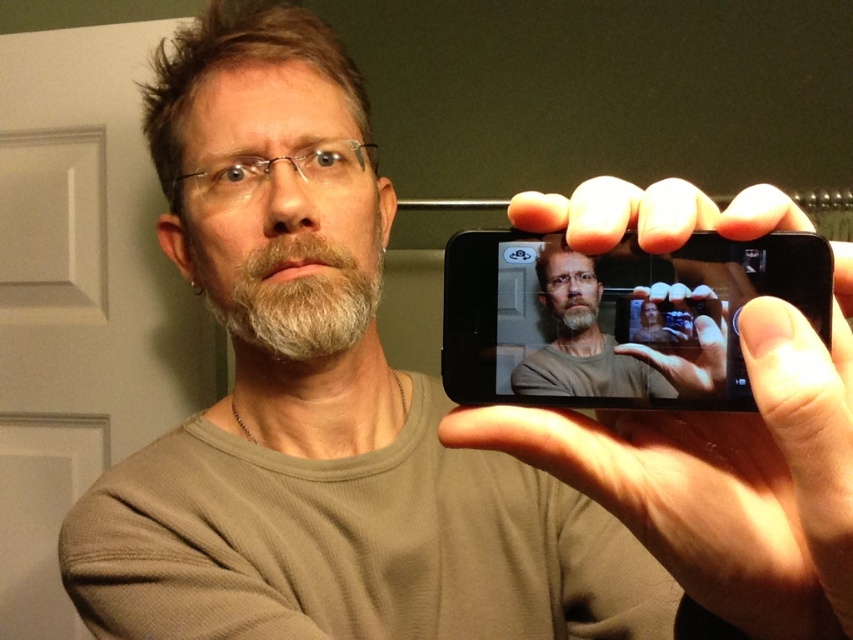
Who is taller, smooth skin hand at upper right or matte black phone at center?

smooth skin hand at upper right is taller.

Which is more to the left, smooth skin hand at upper right or matte black phone at center?

Positioned to the left is matte black phone at center.

Which is behind, point (786, 445) or point (599, 352)?

Point (599, 352)

You are a GUI agent. You are given a task and a screenshot of the screen. Output one action in this format:
    pyautogui.click(x=<x>, y=<y>)
    Task: Click on the smooth skin hand at upper right
    
    Given the screenshot: What is the action you would take?
    pyautogui.click(x=724, y=474)

Based on the photo, who is positioned more to the left, smooth skin hand at upper right or black matte smartphone at center?

black matte smartphone at center

Can you confirm if smooth skin hand at upper right is positioned to the right of black matte smartphone at center?

Indeed, smooth skin hand at upper right is positioned on the right side of black matte smartphone at center.

Measure the distance between smooth skin hand at upper right and camera.

smooth skin hand at upper right is 10.03 inches from camera.

Where is `smooth skin hand at upper right`? smooth skin hand at upper right is located at coordinates (724, 474).

Who is more distant from viewer, (x=583, y=381) or (x=538, y=358)?

The point (x=538, y=358) is more distant.

Does black matte smartphone at center have a greater width compared to matte black phone at center?

Indeed, black matte smartphone at center has a greater width compared to matte black phone at center.

Where is `black matte smartphone at center`? The height and width of the screenshot is (640, 853). black matte smartphone at center is located at coordinates (616, 317).

Find the location of a particular element. Image resolution: width=853 pixels, height=640 pixels. black matte smartphone at center is located at coordinates (616, 317).